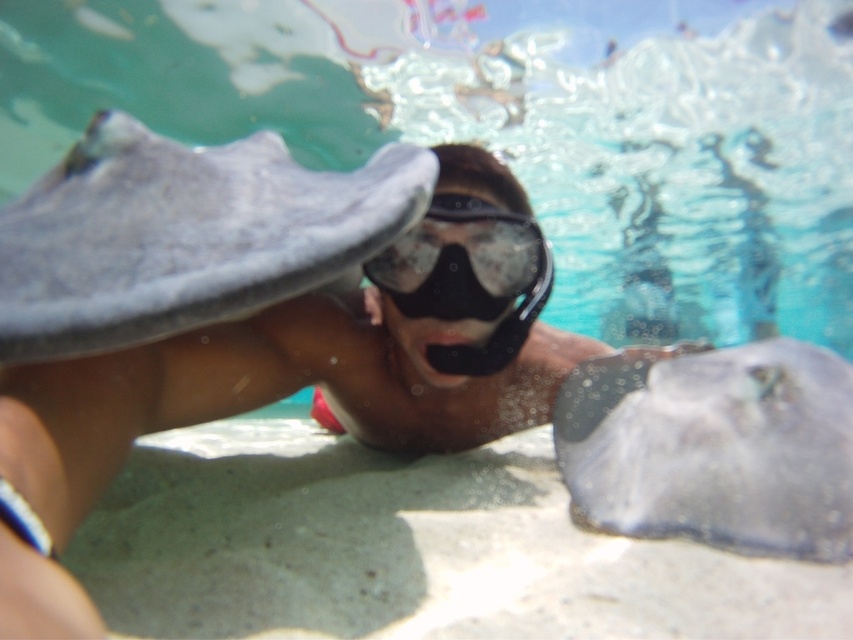
Question: Which point is farther from the camera taking this photo?

Choices:
 (A) (109, 188)
 (B) (447, 198)

Answer: (B)

Question: Can you confirm if matte gray diver at center is positioned below gray matte stingray at center?

Choices:
 (A) yes
 (B) no

Answer: (A)

Question: Which object is farther from the camera taking this photo?

Choices:
 (A) transparent rubber goggles at center
 (B) matte gray diver at center
 (C) translucent rubber stingray at center
 (D) gray matte stingray at center

Answer: (A)

Question: Does matte gray diver at center appear over translucent rubber stingray at center?

Choices:
 (A) yes
 (B) no

Answer: (A)

Question: In this image, where is gray matte stingray at center located relative to transparent rubber goggles at center?

Choices:
 (A) right
 (B) left

Answer: (B)

Question: Which object appears farthest from the camera in this image?

Choices:
 (A) gray matte stingray at center
 (B) transparent rubber goggles at center
 (C) matte gray diver at center

Answer: (B)